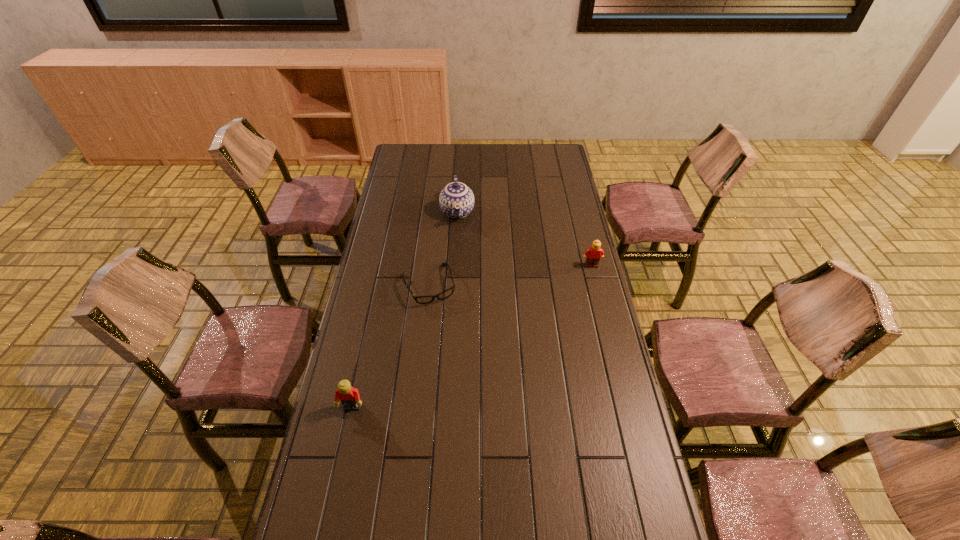
At what (x,y) coordinates should I click in order to perform the action: click on free space located 0.310m on the front-facing side of the spectacles. Please return your answer as a coordinate pair (x, y). This screenshot has height=540, width=960. Looking at the image, I should click on coord(463,375).

Find the location of `free spot located on the front-facing side of the spectacles`. free spot located on the front-facing side of the spectacles is located at coordinates (469, 393).

This screenshot has width=960, height=540. What are the coordinates of `vacant region located at the spout of the chinaware` in the screenshot? It's located at (461, 291).

Identify the location of vacant space positioned 0.170m at the spout of the chinaware. The image size is (960, 540). (459, 257).

Locate an element on the screen. vacant space located at the spout of the chinaware is located at coordinates (458, 241).

Find the location of a particular element. Lego that is at the left edge is located at coordinates (349, 396).

Where is `spectacles that is positioned at the left edge`? spectacles that is positioned at the left edge is located at coordinates (447, 293).

Where is `object that is at the right edge`? object that is at the right edge is located at coordinates (594, 253).

In the image, there is a desktop. Identify the location of free region at the near edge. (458, 517).

In order to click on free space at the left edge in this screenshot , I will do `click(401, 197)`.